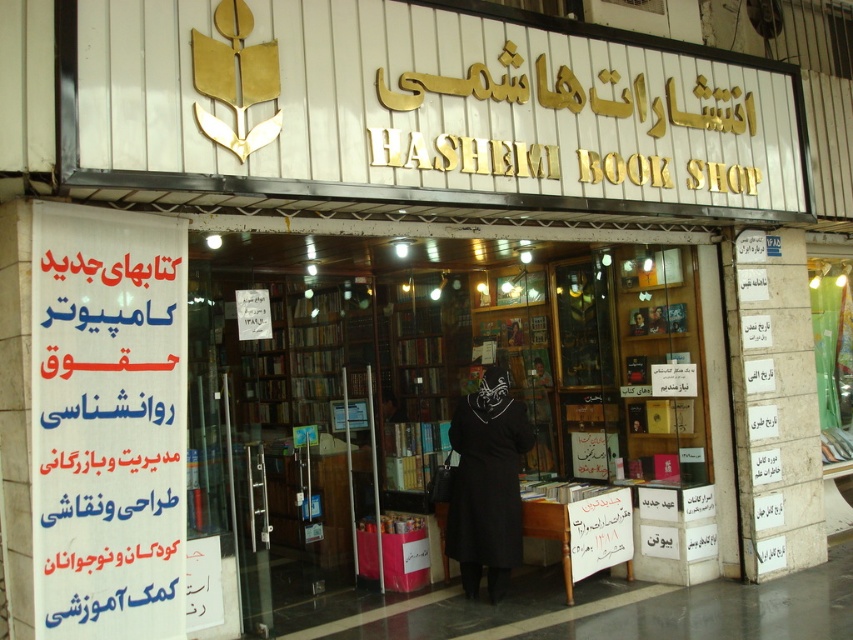
Is point (111, 524) closer to camera compared to point (500, 394)?

Yes, point (111, 524) is closer to viewer.

I want to click on white paper banner at left, so click(108, 422).

Find the location of a particular element. The image size is (853, 640). white paper banner at left is located at coordinates tap(108, 422).